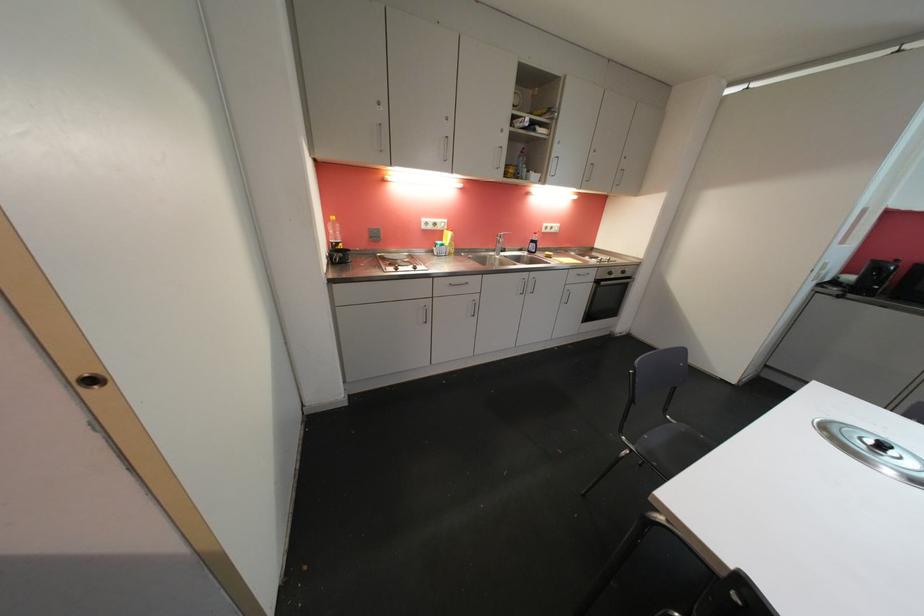
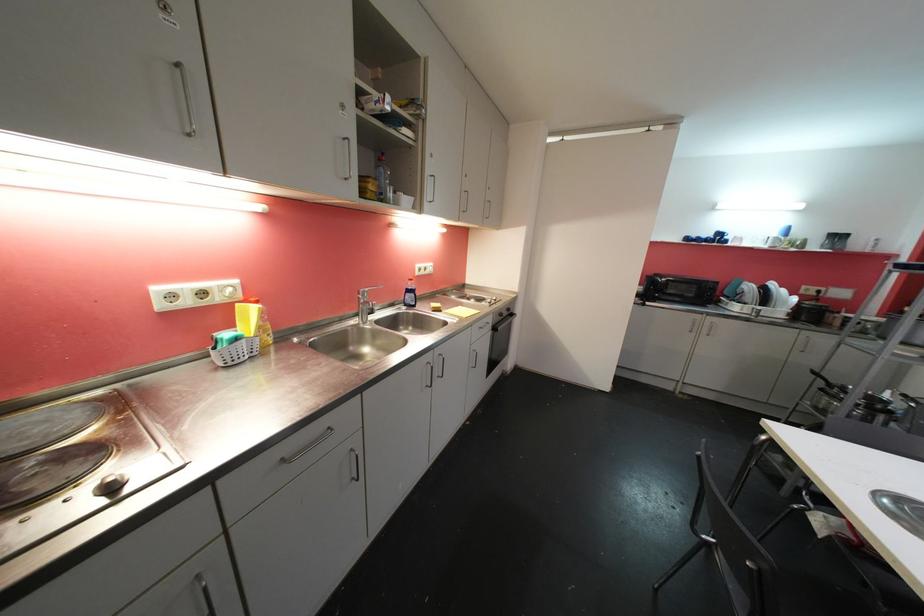
Locate, in the second image, the point that corresponds to point 419,270 in the first image.

(116, 490)